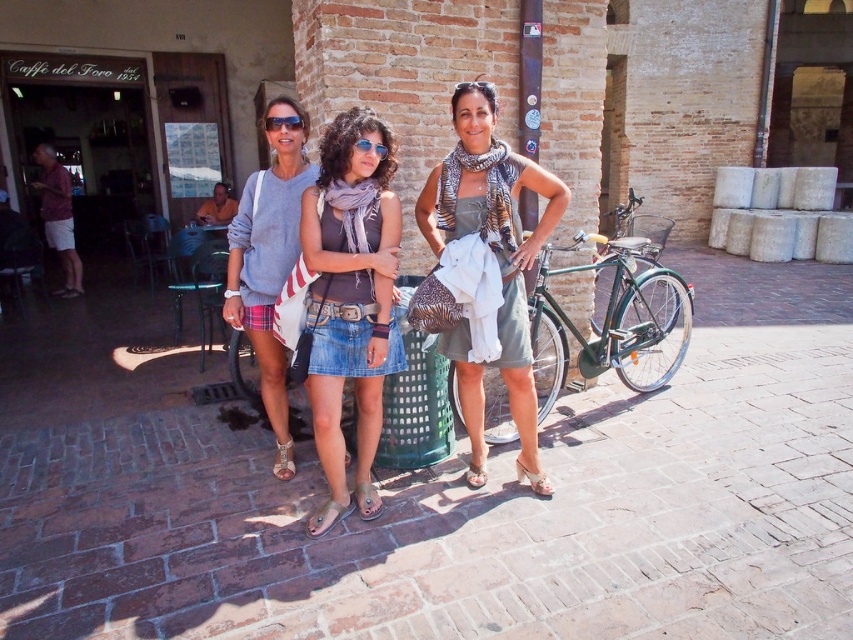
Does maroon cotton shirt at left have a lesser width compared to matte black sunglasses at center?

No, maroon cotton shirt at left is not thinner than matte black sunglasses at center.

Is point (70, 280) farther from viewer compared to point (276, 129)?

Yes.

Find the location of `maroon cotton shirt at left`. maroon cotton shirt at left is located at coordinates (57, 216).

Locate an element on the screen. maroon cotton shirt at left is located at coordinates (57, 216).

Does green dress at center come behind sunglasses at center?

Yes.

Who is more forward, (x=550, y=188) or (x=363, y=152)?

Point (x=363, y=152)

Where is `green dress at center`? The height and width of the screenshot is (640, 853). green dress at center is located at coordinates (488, 268).

Between green dress at center and green matte bicycle at right, which one is positioned higher?

green dress at center is higher up.

What do you see at coordinates (488, 268) in the screenshot?
I see `green dress at center` at bounding box center [488, 268].

Is point (564, 189) positioned in front of point (664, 371)?

Yes, it is in front of point (664, 371).

The height and width of the screenshot is (640, 853). Find the location of `green dress at center`. green dress at center is located at coordinates (488, 268).